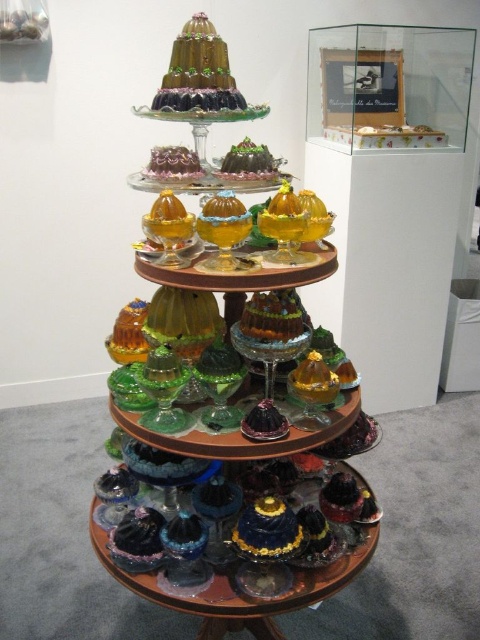
Based on the photo, between shiny dark blue cake at center and green glass wine glass at center, which one appears on the right side from the viewer's perspective?

shiny dark blue cake at center is more to the right.

Is shiny dark blue cake at center positioned in front of green glass wine glass at center?

No, it is not.

Where is `shiny dark blue cake at center`? This screenshot has width=480, height=640. shiny dark blue cake at center is located at coordinates 267,531.

Does shiny gold cake at center lie in front of shiny dark blue cake at center?

No, it is behind shiny dark blue cake at center.

Between shiny gold cake at center and shiny dark blue cake at center, which one has more height?

shiny gold cake at center is taller.

Find the location of `shiny gold cake at center`. shiny gold cake at center is located at coordinates (197, 72).

I want to click on shiny gold cake at center, so coord(197,72).

Is translucent amber glass wine glass at center shorter than shiny dark blue cake at center?

Incorrect, translucent amber glass wine glass at center's height does not fall short of shiny dark blue cake at center's.

Can you confirm if translucent amber glass wine glass at center is smaller than shiny dark blue cake at center?

No.

Is point (289, 346) farther from camera compared to point (240, 536)?

No, it is in front of (240, 536).

Find the location of a particular element. The image size is (480, 640). translucent amber glass wine glass at center is located at coordinates (266, 381).